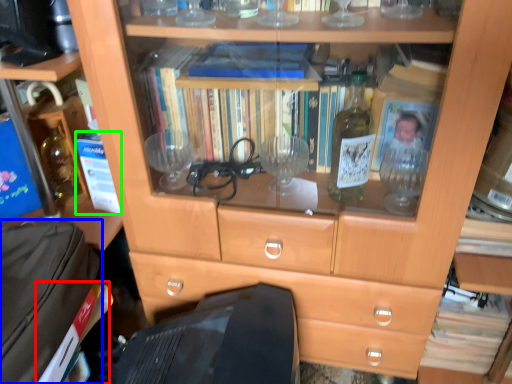
Question: Which object is positioned farthest from paperback book (highlighted by a red box)? Select from luggage (highlighted by a blue box) and paperback book (highlighted by a green box).

Choices:
 (A) luggage
 (B) paperback book

Answer: (B)